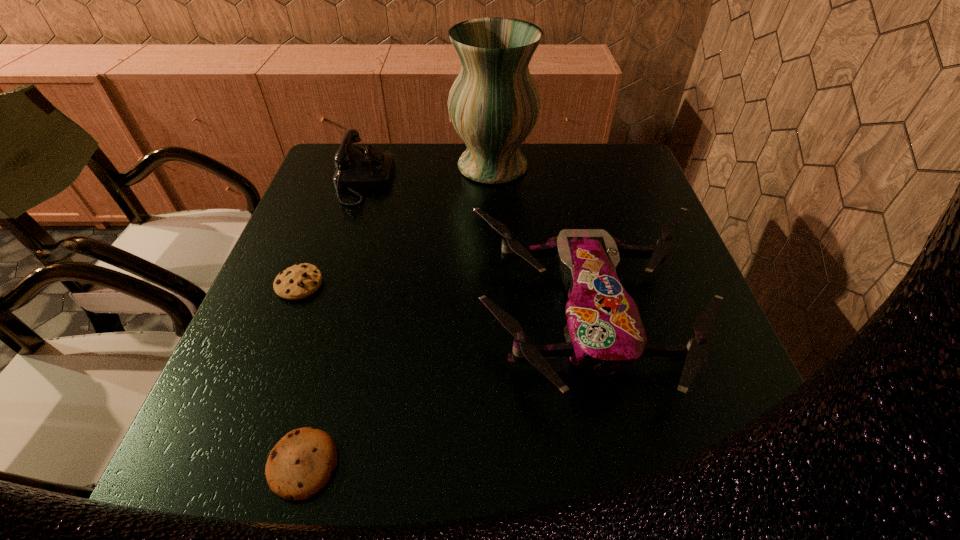
Image resolution: width=960 pixels, height=540 pixels. In order to click on vase in this screenshot , I will do `click(494, 103)`.

Locate an element on the screen. Image resolution: width=960 pixels, height=540 pixels. telephone is located at coordinates (356, 168).

Locate an element on the screen. The width and height of the screenshot is (960, 540). drone is located at coordinates (604, 334).

Identify the location of the farther cookie. (299, 281).

Where is `the nearest object`? The width and height of the screenshot is (960, 540). the nearest object is located at coordinates (301, 463).

This screenshot has width=960, height=540. I want to click on the right cookie, so (301, 463).

Where is `vacant space situated 0.270m on the right of the vase`? Image resolution: width=960 pixels, height=540 pixels. vacant space situated 0.270m on the right of the vase is located at coordinates (628, 166).

The image size is (960, 540). I want to click on vacant space located 0.270m on the dial of the telephone, so click(489, 181).

At what (x,y) coordinates should I click in order to perform the action: click on vacant space located 0.130m on the front-facing side of the drone. Please return your answer as a coordinate pair (x, y). The image size is (960, 540). Looking at the image, I should click on (631, 503).

This screenshot has width=960, height=540. In order to click on free space located 0.210m on the back of the left cookie in this screenshot , I will do `click(328, 210)`.